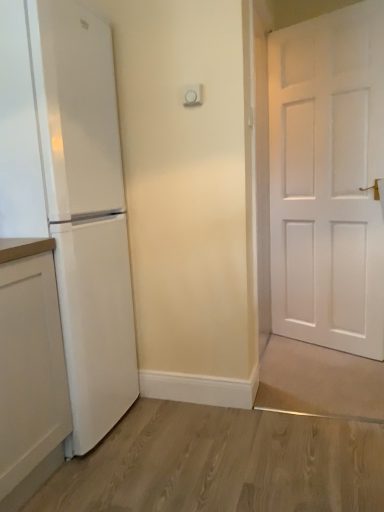
This screenshot has width=384, height=512. Describe the element at coordinates (71, 194) in the screenshot. I see `white matte refrigerator at left` at that location.

Identify the location of white matte refrigerator at left. (71, 194).

The height and width of the screenshot is (512, 384). What do you see at coordinates (30, 360) in the screenshot?
I see `white matte cabinet at left` at bounding box center [30, 360].

Locate an element on the screen. This screenshot has width=384, height=512. white matte cabinet at left is located at coordinates (30, 360).

Where is `white matte refrigerator at left`? white matte refrigerator at left is located at coordinates (71, 194).

Is white matte cabinet at left to the left of white matte refrigerator at left from the viewer's perspective?

Correct, you'll find white matte cabinet at left to the left of white matte refrigerator at left.

Is the position of white matte cabinet at left less distant than that of white matte refrigerator at left?

Yes, the depth of white matte cabinet at left is less than that of white matte refrigerator at left.

Is point (2, 489) farther from viewer compared to point (27, 212)?

That is False.

From the image's perspective, is white matte cabinet at left above or below white matte refrigerator at left?

white matte cabinet at left is below white matte refrigerator at left.

From a real-world perspective, is white matte cabinet at left physically located above or below white matte refrigerator at left?

white matte cabinet at left is below white matte refrigerator at left.

In the scene shown: Which of these two, white matte cabinet at left or white matte refrigerator at left, is thinner?

With smaller width is white matte cabinet at left.

Considering the sizes of white matte cabinet at left and white matte refrigerator at left in the image, is white matte cabinet at left taller or shorter than white matte refrigerator at left?

Clearly, white matte cabinet at left is shorter compared to white matte refrigerator at left.

Is white matte cabinet at left smaller than white matte refrigerator at left?

Correct, white matte cabinet at left occupies less space than white matte refrigerator at left.

Looking at this image, is white matte cabinet at left inside the boundaries of white matte refrigerator at left, or outside?

white matte cabinet at left exists outside the volume of white matte refrigerator at left.

Are white matte cabinet at left and white matte refrigerator at left far apart?

Actually, white matte cabinet at left and white matte refrigerator at left are a little close together.

Is white matte cabinet at left facing towards white matte refrigerator at left?

No, white matte cabinet at left is not oriented towards white matte refrigerator at left.

The image size is (384, 512). Identify the location of refrigerator above the white matte cabinet at left (from a real-world perspective). (71, 194).

Considering the positions of objects white matte refrigerator at left and white matte cabinet at left in the image provided, who is more to the left, white matte refrigerator at left or white matte cabinet at left?

white matte cabinet at left.

Is white matte refrigerator at left positioned before white matte cabinet at left?

No, white matte refrigerator at left is further to the viewer.

Which is less distant, (63, 298) or (55, 282)?

Point (63, 298).

From the image's perspective, who appears lower, white matte refrigerator at left or white matte cabinet at left?

white matte cabinet at left is shown below in the image.

Looking at this image, from a real-world perspective, is white matte refrigerator at left physically located above or below white matte cabinet at left?

Clearly, from a real-world perspective, white matte refrigerator at left is above white matte cabinet at left.

Considering the relative sizes of white matte refrigerator at left and white matte cabinet at left in the image provided, is white matte refrigerator at left thinner than white matte cabinet at left?

No, white matte refrigerator at left is not thinner than white matte cabinet at left.

Which of these two, white matte refrigerator at left or white matte cabinet at left, stands shorter?

With less height is white matte cabinet at left.

Considering the relative sizes of white matte refrigerator at left and white matte cabinet at left in the image provided, is white matte refrigerator at left bigger than white matte cabinet at left?

Indeed, white matte refrigerator at left has a larger size compared to white matte cabinet at left.

Is white matte refrigerator at left situated inside white matte cabinet at left or outside?

white matte refrigerator at left is spatially situated outside white matte cabinet at left.

Can you see white matte refrigerator at left touching white matte cabinet at left?

No, white matte refrigerator at left is not touching white matte cabinet at left.

Looking at this image, is white matte refrigerator at left oriented away from white matte cabinet at left?

That's not correct — white matte refrigerator at left is not looking away from white matte cabinet at left.

How different are the orientations of white matte refrigerator at left and white matte cabinet at left in degrees?

0.661 degrees separate the facing orientations of white matte refrigerator at left and white matte cabinet at left.

I want to click on cabinetry below the white matte refrigerator at left (from the image's perspective), so click(30, 360).

Locate an element on the screen. refrigerator located above the white matte cabinet at left (from the image's perspective) is located at coordinates (71, 194).

In order to click on cabinetry that is in front of the white matte refrigerator at left in this screenshot , I will do `click(30, 360)`.